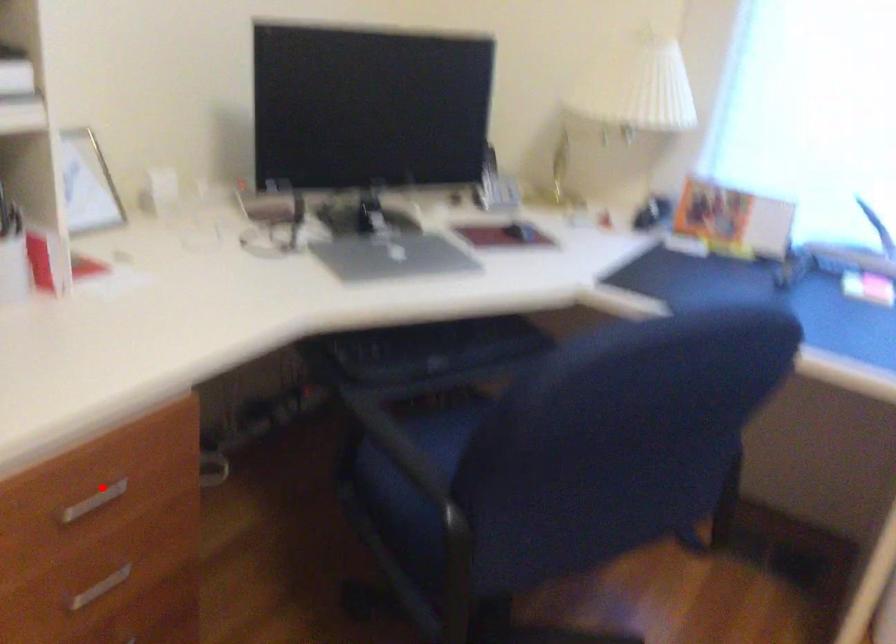
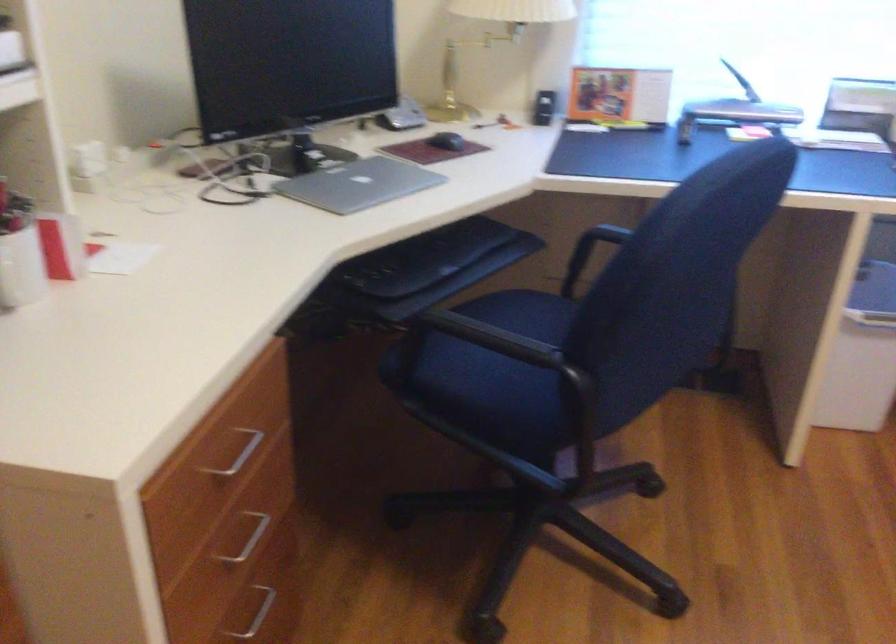
Locate, in the second image, the point that corresponds to the highlighted location in the first image.

(238, 453)